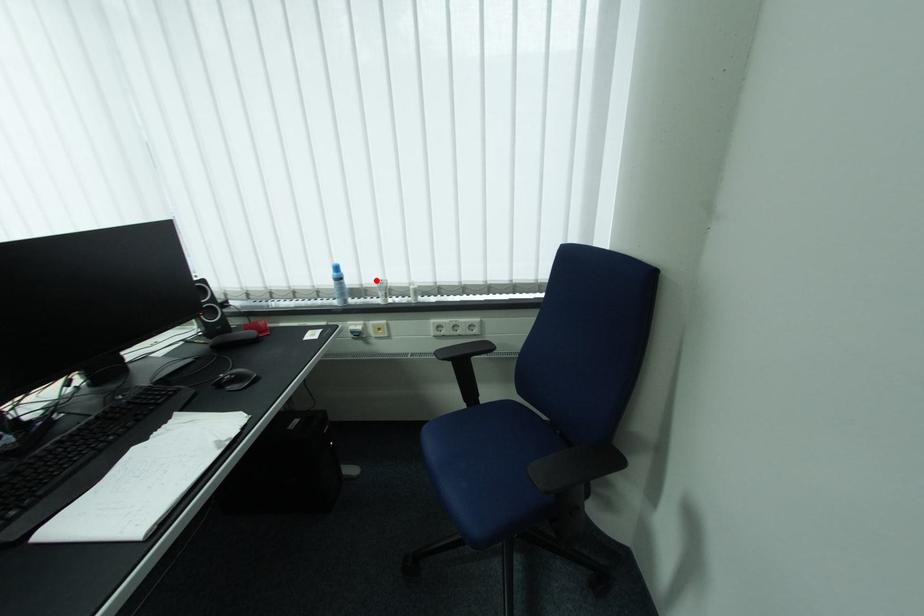
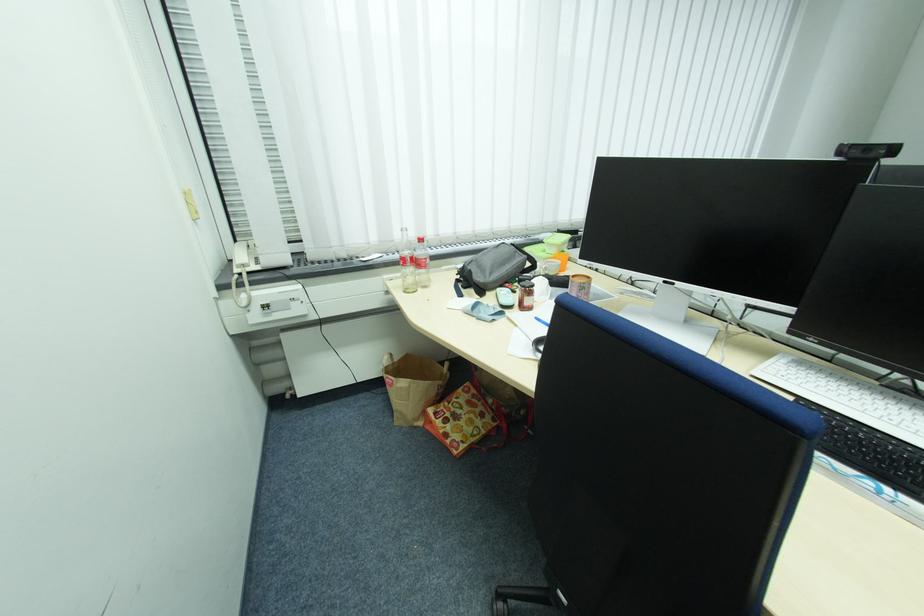
Question: I am providing you with two images of the same scene from different viewpoints. A red point is marked on the first image. At the location where the point appears in image 1, is it still visible in image 2?

Choices:
 (A) Yes
 (B) No

Answer: (B)